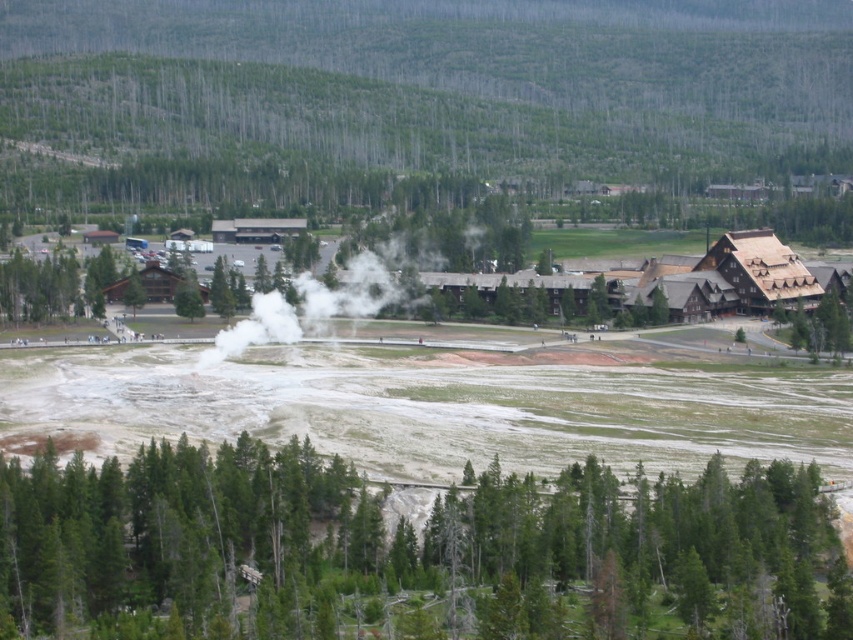
Question: Which point is closer to the camera?

Choices:
 (A) (138, 291)
 (B) (18, 509)
 (C) (306, 291)
 (D) (822, 337)

Answer: (B)

Question: Can you confirm if green textured trees at lower center is positioned to the left of brown wooden building at right?

Choices:
 (A) no
 (B) yes

Answer: (B)

Question: Which point is farther to the camera?

Choices:
 (A) (778, 480)
 (B) (131, 273)
 (C) (386, 289)

Answer: (B)

Question: Does green matte tree at lower left have a lesser width compared to green matte tree at center?

Choices:
 (A) no
 (B) yes

Answer: (A)

Question: Among these points, which one is farthest from the camera?

Choices:
 (A) (308, 296)
 (B) (126, 307)

Answer: (B)

Question: Can you confirm if green matte tree at lower left is bigger than white steam at center?

Choices:
 (A) yes
 (B) no

Answer: (B)